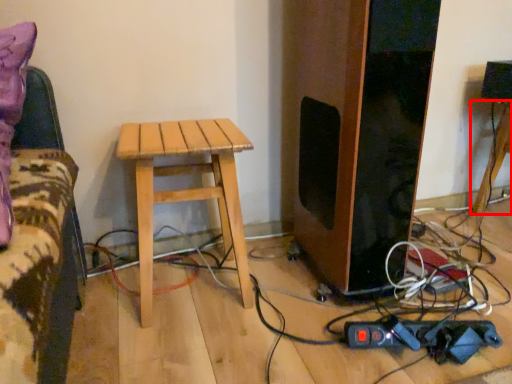
Question: Considering the relative positions of table (annotated by the red box) and stool in the image provided, where is table (annotated by the red box) located with respect to the staircase?

Choices:
 (A) left
 (B) right

Answer: (B)